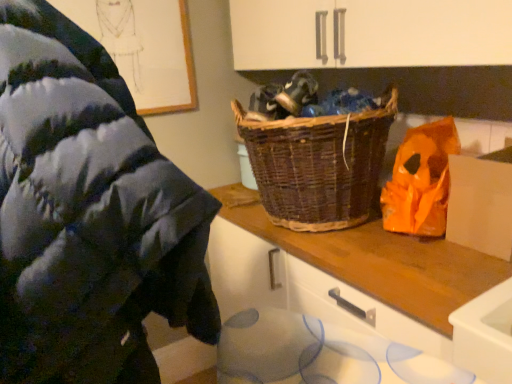
Question: Is woolen sweater at upper left taller than orange plastic bag at right?

Choices:
 (A) yes
 (B) no

Answer: (A)

Question: From the image's perspective, would you say woolen sweater at upper left is positioned over orange plastic bag at right?

Choices:
 (A) yes
 (B) no

Answer: (B)

Question: Is woolen sweater at upper left turned away from orange plastic bag at right?

Choices:
 (A) no
 (B) yes

Answer: (A)

Question: Is woolen sweater at upper left beside orange plastic bag at right?

Choices:
 (A) yes
 (B) no

Answer: (B)

Question: From a real-world perspective, does woolen sweater at upper left stand above orange plastic bag at right?

Choices:
 (A) no
 (B) yes

Answer: (A)

Question: Is woolen sweater at upper left spatially inside woven brown picnic basket at center, or outside of it?

Choices:
 (A) inside
 (B) outside

Answer: (B)

Question: From the image's perspective, is woolen sweater at upper left above or below woven brown picnic basket at center?

Choices:
 (A) below
 (B) above

Answer: (A)

Question: Is point (99, 150) closer or farther from the camera than point (349, 188)?

Choices:
 (A) farther
 (B) closer

Answer: (B)

Question: From a real-world perspective, relative to woven brown picnic basket at center, is woolen sweater at upper left vertically above or below?

Choices:
 (A) below
 (B) above

Answer: (A)

Question: Choose the correct answer: Is woven brown picnic basket at center inside white cardboard at right or outside it?

Choices:
 (A) inside
 (B) outside

Answer: (B)

Question: Is woven brown picnic basket at center in front of or behind white cardboard at right in the image?

Choices:
 (A) behind
 (B) front

Answer: (A)

Question: In terms of size, does woven brown picnic basket at center appear bigger or smaller than white cardboard at right?

Choices:
 (A) big
 (B) small

Answer: (A)

Question: From the image's perspective, is woven brown picnic basket at center positioned above or below white cardboard at right?

Choices:
 (A) below
 (B) above

Answer: (B)

Question: From the image's perspective, is woven brown picnic basket at center positioned above or below woolen sweater at upper left?

Choices:
 (A) above
 (B) below

Answer: (A)

Question: Relative to woolen sweater at upper left, is woven brown picnic basket at center in front or behind?

Choices:
 (A) front
 (B) behind

Answer: (B)